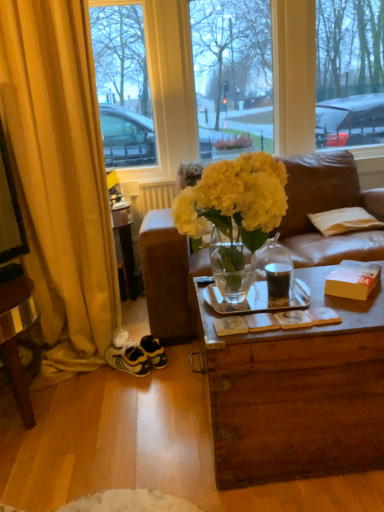
Question: Considering the relative sizes of translucent leather couch at center and yellow fabric curtain at left in the image provided, is translucent leather couch at center taller than yellow fabric curtain at left?

Choices:
 (A) no
 (B) yes

Answer: (A)

Question: Is translucent leather couch at center turned away from yellow fabric curtain at left?

Choices:
 (A) no
 (B) yes

Answer: (A)

Question: Is translucent leather couch at center shorter than yellow fabric curtain at left?

Choices:
 (A) no
 (B) yes

Answer: (B)

Question: Considering the relative positions of translucent leather couch at center and yellow fabric curtain at left in the image provided, is translucent leather couch at center to the right of yellow fabric curtain at left from the viewer's perspective?

Choices:
 (A) yes
 (B) no

Answer: (A)

Question: Is translucent leather couch at center wider than yellow fabric curtain at left?

Choices:
 (A) yes
 (B) no

Answer: (A)

Question: Is yellow fabric curtain at left completely or partially inside translucent leather couch at center?

Choices:
 (A) no
 (B) yes

Answer: (A)

Question: Can you confirm if orange cardboard box at right is taller than translucent leather couch at center?

Choices:
 (A) no
 (B) yes

Answer: (A)

Question: Is the depth of orange cardboard box at right less than that of translucent leather couch at center?

Choices:
 (A) no
 (B) yes

Answer: (A)

Question: Can you confirm if orange cardboard box at right is thinner than translucent leather couch at center?

Choices:
 (A) no
 (B) yes

Answer: (B)

Question: Could you tell me if orange cardboard box at right is turned towards translucent leather couch at center?

Choices:
 (A) no
 (B) yes

Answer: (A)

Question: From a real-world perspective, is orange cardboard box at right under translucent leather couch at center?

Choices:
 (A) no
 (B) yes

Answer: (B)

Question: From the image's perspective, is orange cardboard box at right over translucent leather couch at center?

Choices:
 (A) no
 (B) yes

Answer: (A)

Question: Considering the relative sizes of white matte radiator at upper center and yellow fabric curtain at left in the image provided, is white matte radiator at upper center taller than yellow fabric curtain at left?

Choices:
 (A) no
 (B) yes

Answer: (A)